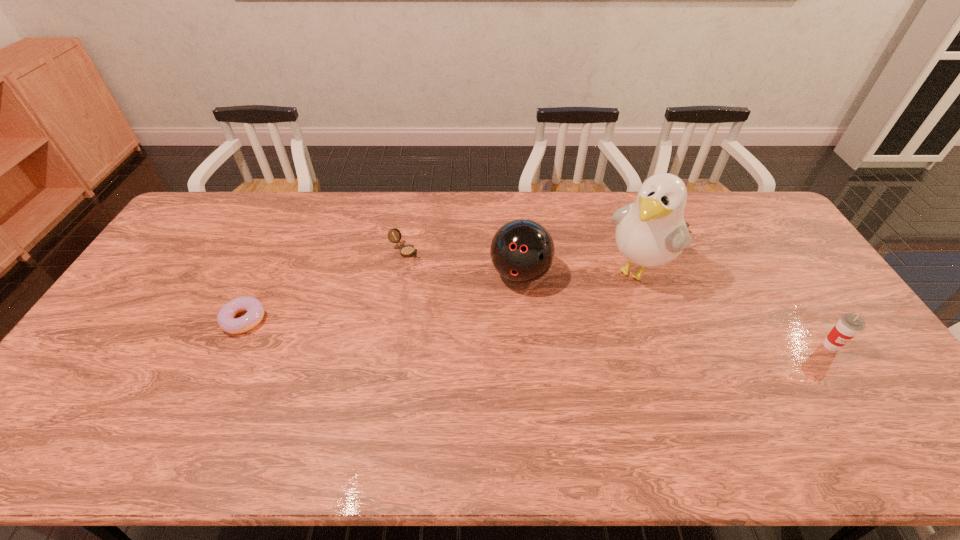
Locate an element on the screen. This screenshot has width=960, height=540. vacant area situated on the left of the leftmost object is located at coordinates (170, 320).

Identify the location of vacant space located on the side of the cup with the logo. (868, 402).

Locate an element on the screen. This screenshot has width=960, height=540. free spot located on the beak of the second object from right to left is located at coordinates [x=593, y=320].

I want to click on blank space located 0.180m on the beak of the second object from right to left, so click(588, 326).

Image resolution: width=960 pixels, height=540 pixels. In order to click on free space located on the beak of the second object from right to left in this screenshot , I will do `click(553, 365)`.

Locate an element on the screen. This screenshot has width=960, height=540. vacant space located 0.140m on the surface of the third object from right to left near the finger holes is located at coordinates (499, 331).

The height and width of the screenshot is (540, 960). Find the location of `free space located 0.080m on the surface of the third object from right to left near the finger holes`. free space located 0.080m on the surface of the third object from right to left near the finger holes is located at coordinates (505, 315).

Find the location of a particular element. The image size is (960, 540). free space located on the surface of the third object from right to left near the finger holes is located at coordinates (474, 400).

Where is `free space located on the face of the compass`? The height and width of the screenshot is (540, 960). free space located on the face of the compass is located at coordinates (504, 310).

This screenshot has height=540, width=960. Identify the location of free space located on the face of the compass. (512, 315).